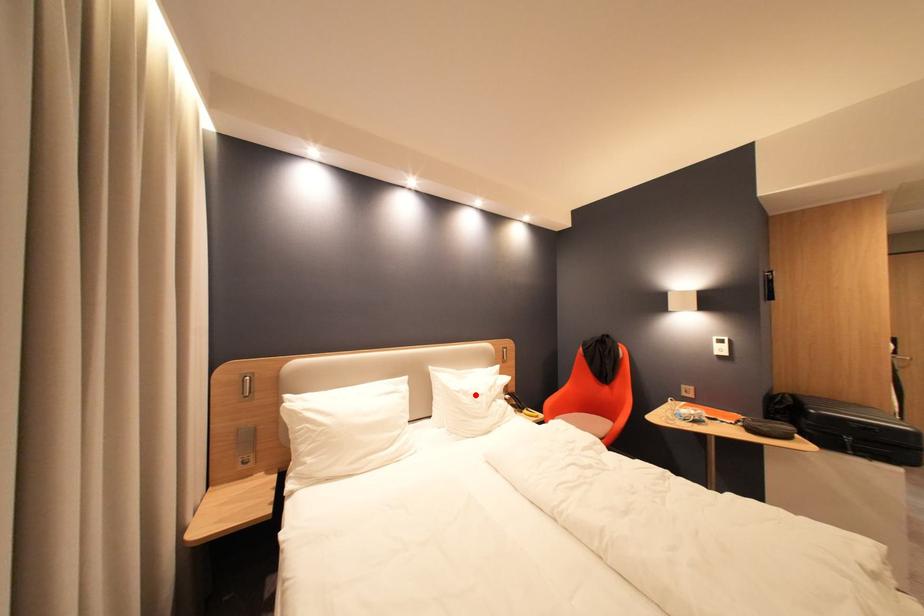
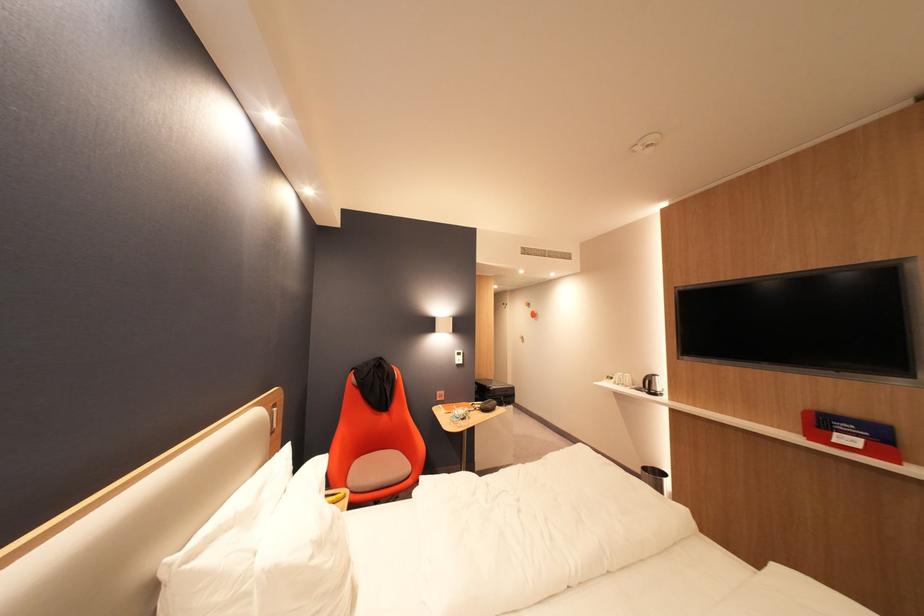
Question: I am providing you with two images of the same scene from different viewpoints. Given a red point in image1, look at the same physical point in image2. Is it:

Choices:
 (A) Closer to the viewpoint
 (B) Farther from the viewpoint

Answer: (A)